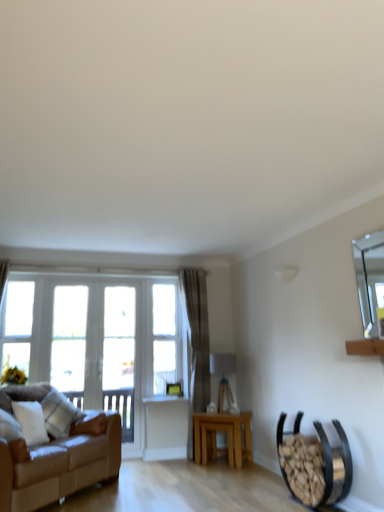
Question: Could you tell me if brown leather couch at left is turned towards light brown wooden table at center?

Choices:
 (A) no
 (B) yes

Answer: (A)

Question: Considering the relative sizes of brown leather couch at left and light brown wooden table at center in the image provided, is brown leather couch at left bigger than light brown wooden table at center?

Choices:
 (A) yes
 (B) no

Answer: (A)

Question: Does brown leather couch at left have a greater width compared to light brown wooden table at center?

Choices:
 (A) yes
 (B) no

Answer: (A)

Question: Is brown leather couch at left further to camera compared to light brown wooden table at center?

Choices:
 (A) no
 (B) yes

Answer: (A)

Question: Can you confirm if brown leather couch at left is smaller than light brown wooden table at center?

Choices:
 (A) yes
 (B) no

Answer: (B)

Question: Is brown leather couch at left shorter than light brown wooden table at center?

Choices:
 (A) yes
 (B) no

Answer: (B)

Question: Considering the relative sizes of light brown wooden table at center and clear glass window at left, which is the second window from right to left, in the image provided, is light brown wooden table at center wider than clear glass window at left, which is the second window from right to left,?

Choices:
 (A) no
 (B) yes

Answer: (B)

Question: Considering the relative positions of light brown wooden table at center and clear glass window at left, positioned as the 2th window in left-to-right order, in the image provided, is light brown wooden table at center to the left of clear glass window at left, positioned as the 2th window in left-to-right order, from the viewer's perspective?

Choices:
 (A) no
 (B) yes

Answer: (A)

Question: Is light brown wooden table at center shorter than clear glass window at left, positioned as the 2th window in left-to-right order?

Choices:
 (A) yes
 (B) no

Answer: (A)

Question: Does light brown wooden table at center turn towards clear glass window at left, positioned as the 2th window in left-to-right order?

Choices:
 (A) yes
 (B) no

Answer: (B)

Question: Does light brown wooden table at center contain clear glass window at left, positioned as the 2th window in left-to-right order?

Choices:
 (A) no
 (B) yes

Answer: (A)

Question: Does light brown wooden table at center appear on the right side of clear glass window at left, which is the second window from right to left?

Choices:
 (A) yes
 (B) no

Answer: (A)

Question: From the image's perspective, is clear glass window at left, positioned as the 2th window in left-to-right order, located beneath clear glass window at center, arranged as the 3th window when viewed from the left?

Choices:
 (A) yes
 (B) no

Answer: (A)